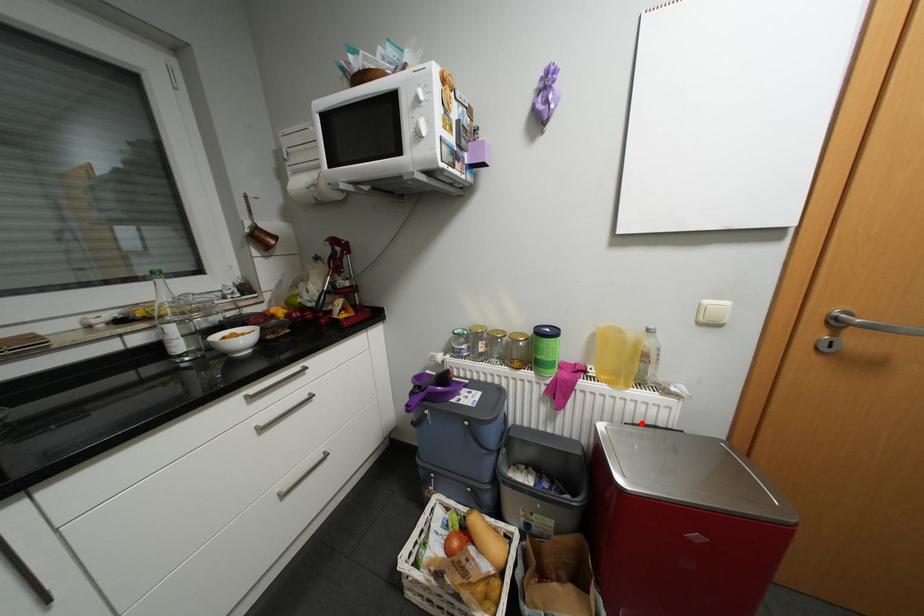
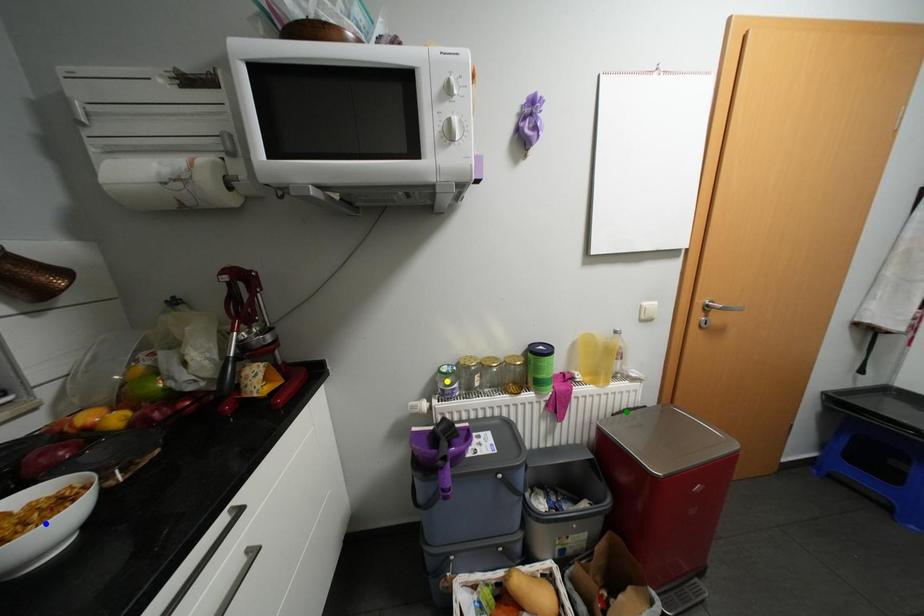
Question: I am providing you with two images of the same scene from different viewpoints. A red point is marked on the first image. You are given multiple points on the second image. Can you choose the point in image 2 that corresponds to the point in image 1?

Choices:
 (A) green point
 (B) blue point
 (C) yellow point

Answer: (A)